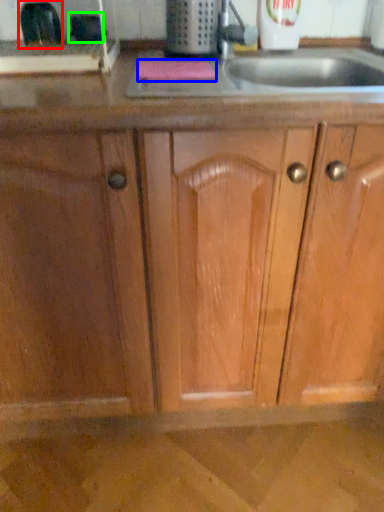
Question: Which is farther away from appliance (highlighted by a red box)? soap (highlighted by a blue box) or appliance (highlighted by a green box)?

Choices:
 (A) soap
 (B) appliance

Answer: (A)